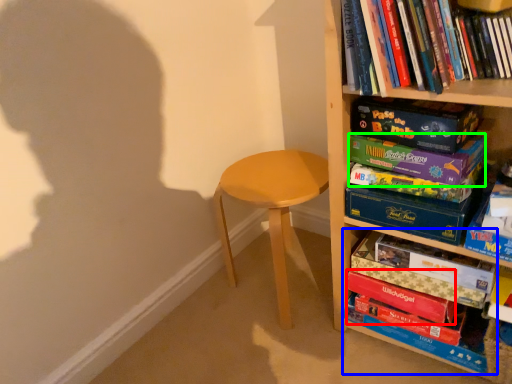
Question: Which object is the closest to the paperback book (highlighted by a red box)? Choose among these: book (highlighted by a blue box) or paperback book (highlighted by a green box).

Choices:
 (A) book
 (B) paperback book

Answer: (A)